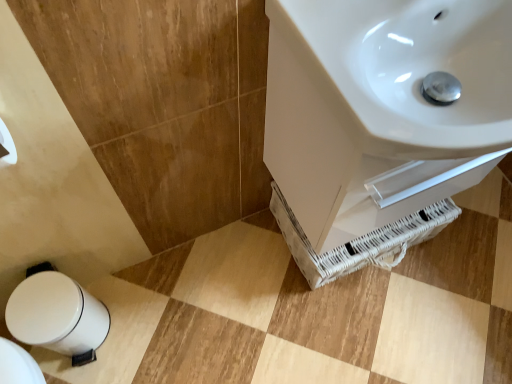
Identify the location of vacant space to the right of white glossy trash can at lower left. The width and height of the screenshot is (512, 384). (144, 328).